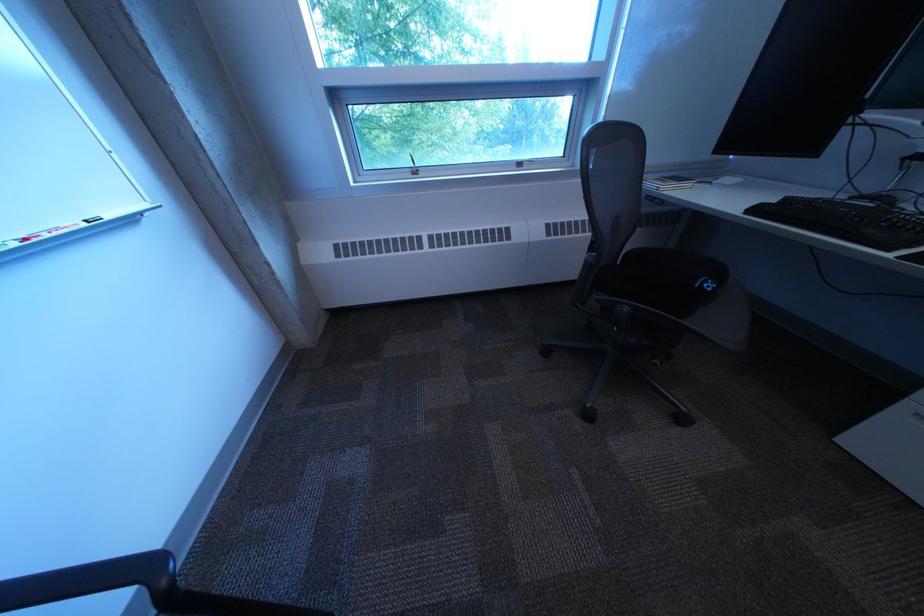
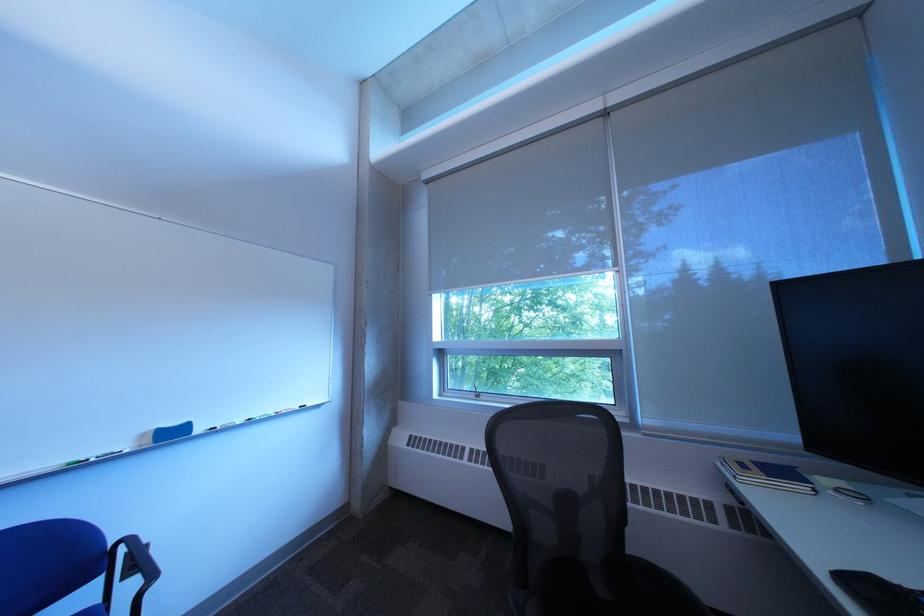
Where in the second image is the point corresponding to pixel 767 213 from the first image?

(860, 582)